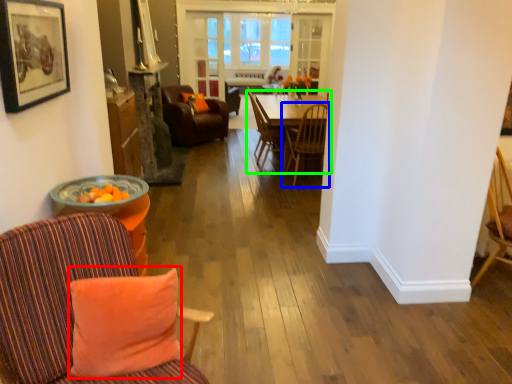
Question: Which object is the farthest from pillow (highlighted by a red box)? Choose among these: chair (highlighted by a blue box) or kitchen & dining room table (highlighted by a green box).

Choices:
 (A) chair
 (B) kitchen & dining room table

Answer: (B)